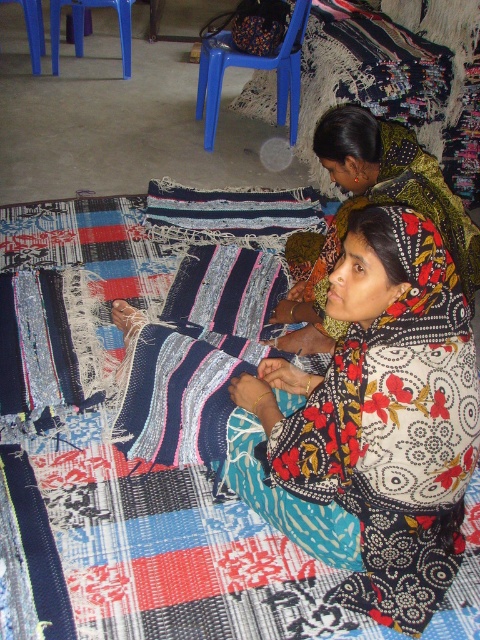
Find the location of a particular element. Image resolution: width=480 pixels, height=640 pixels. floral fabric at center is located at coordinates [379, 420].

Who is shorter, floral fabric at center or blue plastic stool at upper left?

blue plastic stool at upper left

Where is `floral fabric at center`? This screenshot has width=480, height=640. floral fabric at center is located at coordinates (379, 420).

Can you confirm if floral fabric at center is positioned to the right of floral-patterned fabric at center?

Incorrect, floral fabric at center is not on the right side of floral-patterned fabric at center.

Is floral fabric at center smaller than floral-patterned fabric at center?

Yes.

Who is more distant from viewer, [356,352] or [380,195]?

Positioned behind is point [380,195].

Locate an element on the screen. Image resolution: width=480 pixels, height=640 pixels. floral fabric at center is located at coordinates (379, 420).

Is point (442, 234) positioned after point (55, 38)?

No.

Describe the element at coordinates (369, 202) in the screenshot. I see `floral-patterned fabric at center` at that location.

Where is `floral-patterned fabric at center`? The height and width of the screenshot is (640, 480). floral-patterned fabric at center is located at coordinates (369, 202).